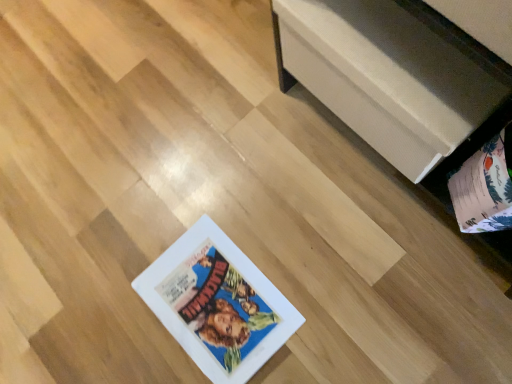
Question: Does matte paper album at lower right have a lesser height compared to white matte storage chest at upper right?

Choices:
 (A) yes
 (B) no

Answer: (B)

Question: Is matte paper album at lower right behind white matte storage chest at upper right?

Choices:
 (A) no
 (B) yes

Answer: (A)

Question: Is matte paper album at lower right smaller than white matte storage chest at upper right?

Choices:
 (A) no
 (B) yes

Answer: (B)

Question: Is matte paper album at lower right with white matte storage chest at upper right?

Choices:
 (A) no
 (B) yes

Answer: (A)

Question: Can you confirm if matte paper album at lower right is taller than white matte storage chest at upper right?

Choices:
 (A) no
 (B) yes

Answer: (B)

Question: From the image's perspective, is matte paper album at lower right on top of white matte storage chest at upper right?

Choices:
 (A) no
 (B) yes

Answer: (A)

Question: Can you confirm if white matte storage chest at upper right is smaller than matte paper album at lower right?

Choices:
 (A) yes
 (B) no

Answer: (B)

Question: Can you confirm if white matte storage chest at upper right is shorter than matte paper album at lower right?

Choices:
 (A) no
 (B) yes

Answer: (B)

Question: Does white matte storage chest at upper right touch matte paper album at lower right?

Choices:
 (A) no
 (B) yes

Answer: (A)

Question: Does white matte storage chest at upper right have a greater width compared to matte paper album at lower right?

Choices:
 (A) no
 (B) yes

Answer: (A)

Question: Is white matte storage chest at upper right outside of matte paper album at lower right?

Choices:
 (A) no
 (B) yes

Answer: (B)

Question: Is white matte storage chest at upper right positioned behind matte paper album at lower right?

Choices:
 (A) yes
 (B) no

Answer: (A)

Question: Considering the positions of point (463, 210) and point (470, 69), is point (463, 210) closer or farther from the camera than point (470, 69)?

Choices:
 (A) farther
 (B) closer

Answer: (A)